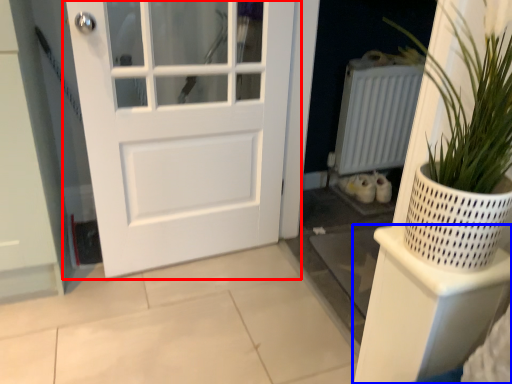
Question: Which of the following is the closest to the observer, door (highlighted by a red box) or shelf (highlighted by a blue box)?

Choices:
 (A) door
 (B) shelf

Answer: (B)